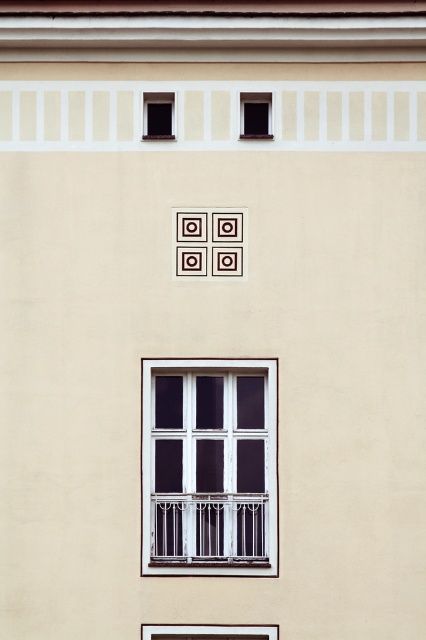
Who is more forward, (164,625) or (155,134)?

Point (164,625)

Is white glass window at center to the right of matte black window at upper left from the viewer's perspective?

Yes, white glass window at center is to the right of matte black window at upper left.

Find the location of a particular element. white glass window at center is located at coordinates (210, 632).

Looking at this image, between white painted wood window at center and matte black window at upper left, which one appears on the right side from the viewer's perspective?

white painted wood window at center is more to the right.

Is white painted wood window at center to the left of matte black window at upper left from the viewer's perspective?

Incorrect, white painted wood window at center is not on the left side of matte black window at upper left.

Which is in front, point (259, 557) or point (169, 125)?

Point (259, 557)

Identify the location of white painted wood window at center. This screenshot has width=426, height=640. (209, 467).

Is white painted wood window at center bigger than transparent glass window at upper center?

Correct, white painted wood window at center is larger in size than transparent glass window at upper center.

Does white painted wood window at center appear on the left side of transparent glass window at upper center?

Yes, white painted wood window at center is to the left of transparent glass window at upper center.

The width and height of the screenshot is (426, 640). What are the coordinates of `white painted wood window at center` in the screenshot? It's located at (209, 467).

In order to click on white painted wood window at center in this screenshot , I will do `click(209, 467)`.